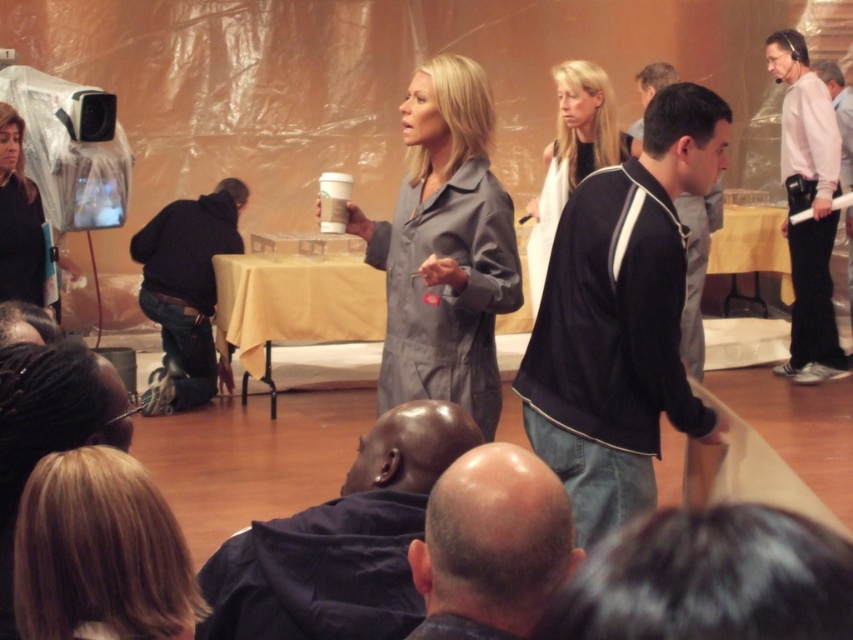
You are an event organizer and need to arrange seating for two VIP guests. The guests want to sit to the right of the white fabric jacket at center and to the left of the white cotton shirt at right. Is this possible given the current setup?

The white cotton shirt at right is positioned on the right side of the white fabric jacket at center. Therefore, there is no space between them to seat the VIP guests as requested. The guests would have to sit either to the right of the white cotton shirt at right or to the left of the white fabric jacket at center.

You are organizing a costume party and need to decide which garment to use as a prop. Based on the image, which of the two garments, the white cotton shirt at right or the white fabric jacket at center, would be more suitable if you need a larger prop?

The white cotton shirt at right is larger in size than the white fabric jacket at center, so it would be more suitable as a larger prop for the costume party.